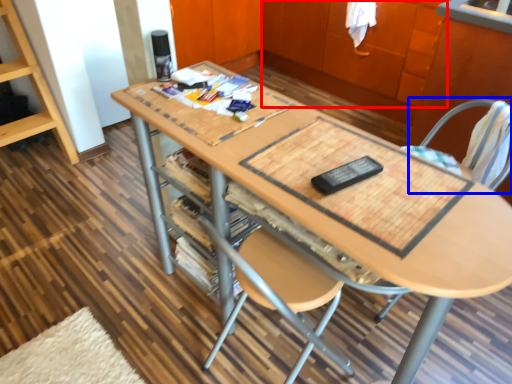
Question: Which object is closer to the camera taking this photo, cabinetry (highlighted by a red box) or swivel chair (highlighted by a blue box)?

Choices:
 (A) cabinetry
 (B) swivel chair

Answer: (B)